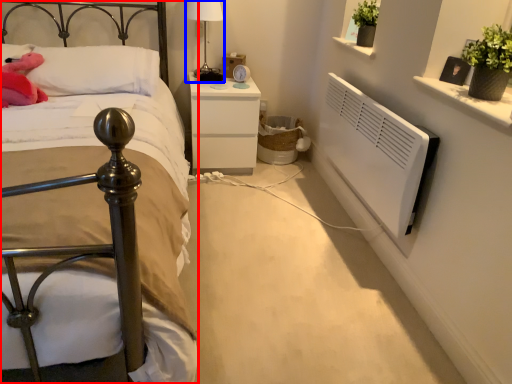
Question: Among these objects, which one is nearest to the camera, bed (highlighted by a red box) or bedside lamp (highlighted by a blue box)?

Choices:
 (A) bed
 (B) bedside lamp

Answer: (A)